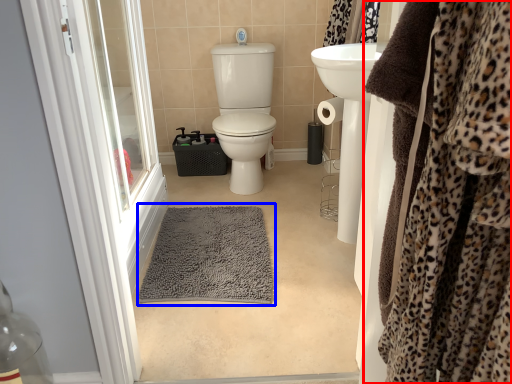
Question: Which of the following is the farthest to the observer, clothing (highlighted by a red box) or bath mat (highlighted by a blue box)?

Choices:
 (A) clothing
 (B) bath mat

Answer: (B)